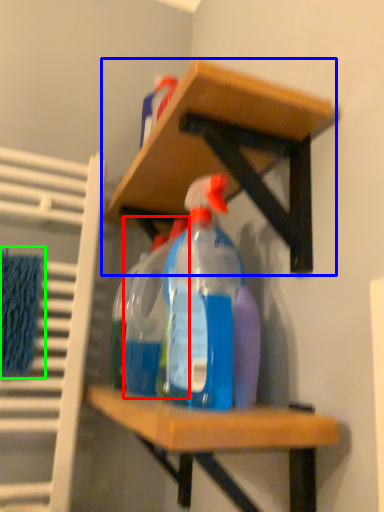
Question: Considering the real-world distances, which object is farthest from bottle (highlighted by a red box)? shelf (highlighted by a blue box) or bath towel (highlighted by a green box)?

Choices:
 (A) shelf
 (B) bath towel

Answer: (B)